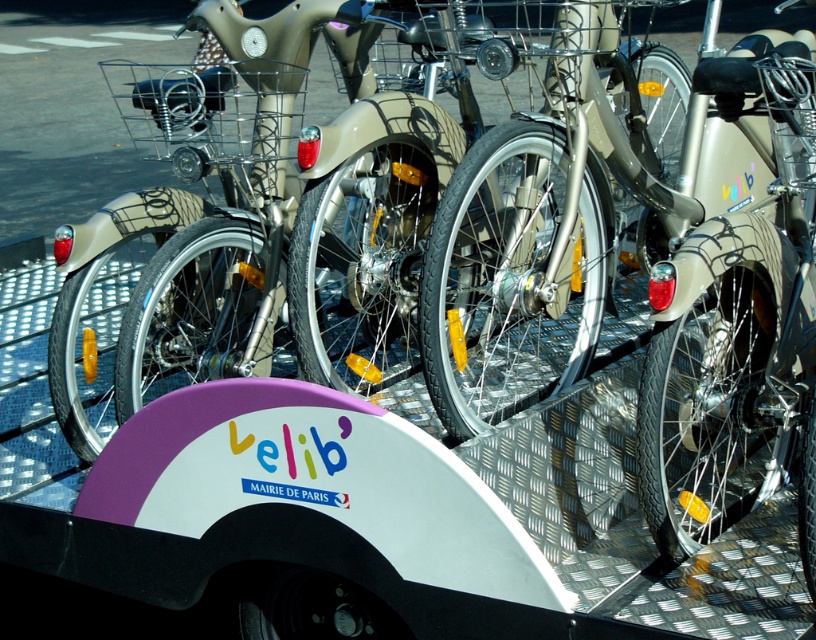
In the scene shown: You are a delivery person who needs to choose a bike that can carry a heavy package. The matte beige bicycle at center and the matte silver bicycle at center are available. Which one should you choose based on their sizes?

The matte beige bicycle at center has a larger size compared to the matte silver bicycle at center, so you should choose the matte beige bicycle at center because it can carry heavier loads due to its larger frame.

You are a delivery person needing to load a package onto the matte beige bicycle at center. The package requires a space of 2.5 meters in front of the bicycle to maneuver. Can you safely maneuver the package into position?

The distance between the matte beige bicycle at center and the camera is 2.44 meters. Since the required space is 2.5 meters, you do not have enough space to safely maneuver the package into position.

You are a delivery person who needs to load a small package onto a bicycle. You have two options in front of you, the matte beige bicycle at center and the matte silver bicycle at center. Which bicycle has a wider frame to accommodate the package?

The matte beige bicycle at center might be wider than matte silver bicycle at center, so it could have a wider frame to accommodate the package.